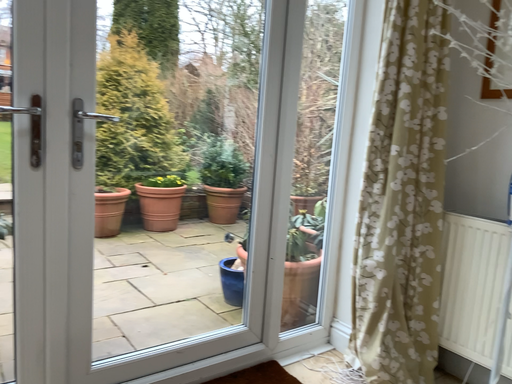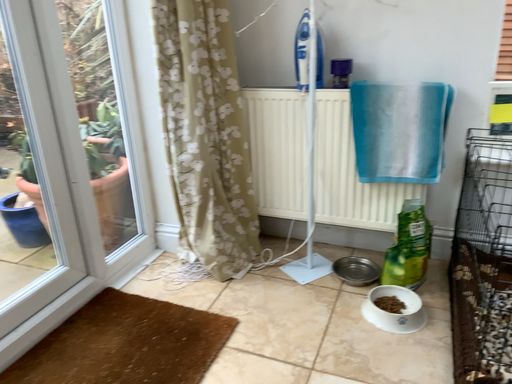
Question: Which way did the camera rotate in the video?

Choices:
 (A) rotated left
 (B) rotated right

Answer: (B)